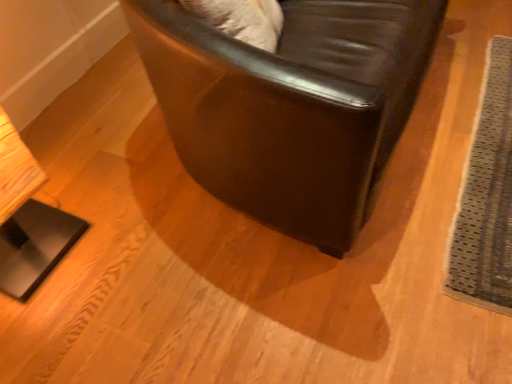
Question: From a real-world perspective, is shiny black leather chair at center physically below textured gray mat at lower right?

Choices:
 (A) no
 (B) yes

Answer: (A)

Question: Is shiny black leather chair at center closer to camera compared to textured gray mat at lower right?

Choices:
 (A) no
 (B) yes

Answer: (B)

Question: From the image's perspective, is shiny black leather chair at center on top of textured gray mat at lower right?

Choices:
 (A) no
 (B) yes

Answer: (B)

Question: Would you consider shiny black leather chair at center to be distant from textured gray mat at lower right?

Choices:
 (A) no
 (B) yes

Answer: (A)

Question: Are shiny black leather chair at center and textured gray mat at lower right making contact?

Choices:
 (A) yes
 (B) no

Answer: (B)

Question: Considering the relative positions of shiny black leather chair at center and textured gray mat at lower right in the image provided, is shiny black leather chair at center to the left of textured gray mat at lower right from the viewer's perspective?

Choices:
 (A) no
 (B) yes

Answer: (B)

Question: Is shiny black leather chair at center located within textured gray mat at lower right?

Choices:
 (A) no
 (B) yes

Answer: (A)

Question: Is there a large distance between textured gray mat at lower right and shiny black leather chair at center?

Choices:
 (A) yes
 (B) no

Answer: (B)

Question: Can you confirm if textured gray mat at lower right is bigger than shiny black leather chair at center?

Choices:
 (A) no
 (B) yes

Answer: (A)

Question: Considering the relative sizes of textured gray mat at lower right and shiny black leather chair at center in the image provided, is textured gray mat at lower right taller than shiny black leather chair at center?

Choices:
 (A) yes
 (B) no

Answer: (B)

Question: Considering the relative sizes of textured gray mat at lower right and shiny black leather chair at center in the image provided, is textured gray mat at lower right thinner than shiny black leather chair at center?

Choices:
 (A) no
 (B) yes

Answer: (A)

Question: Considering the relative positions of textured gray mat at lower right and shiny black leather chair at center in the image provided, is textured gray mat at lower right to the right of shiny black leather chair at center from the viewer's perspective?

Choices:
 (A) no
 (B) yes

Answer: (B)

Question: Is shiny black leather chair at center inside or outside of textured gray mat at lower right?

Choices:
 (A) inside
 (B) outside

Answer: (B)